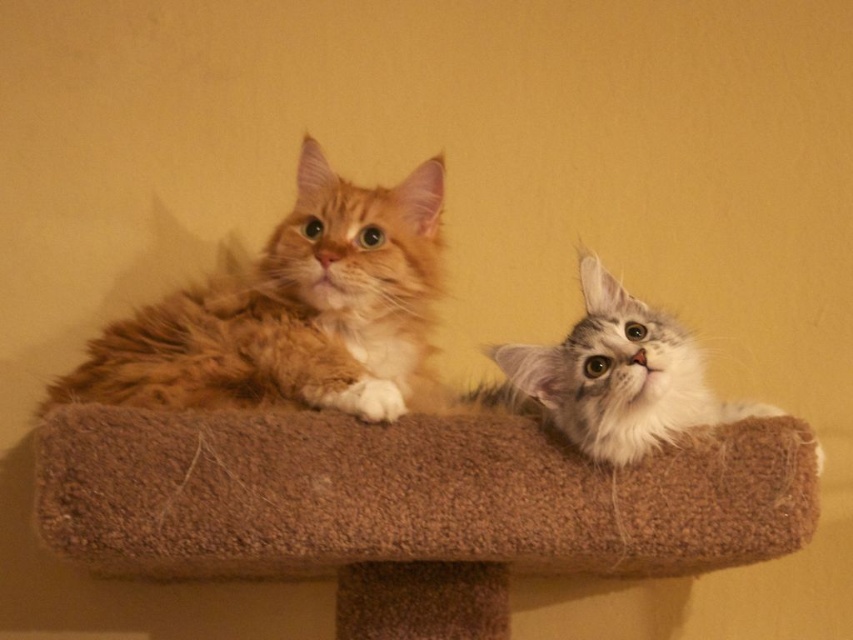
You are a cat owner trying to place a new toy on the cat tree. The cat tree has two points marked at coordinates point (654, 524) and point (115, 387). If you want to place the toy closer to the cat that is looking at the camera, which point should you choose?

Point (654, 524) is in front of point (115, 387), so placing the toy at point (654, 524) would be closer to the cat looking at the camera.

You are standing in front of the cat tree and want to locate the orange fur cat at upper left. Can you tell me its coordinates?

The orange fur cat at upper left is located at coordinates point (291, 310).